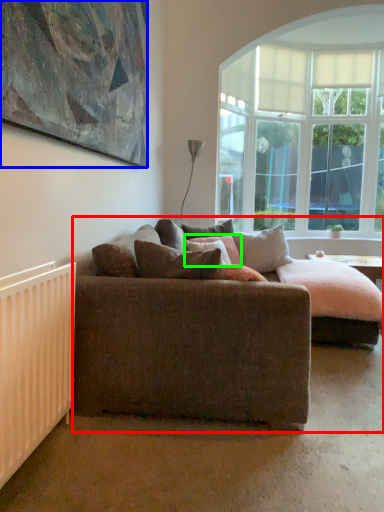
Question: Which object is positioned farthest from studio couch (highlighted by a red box)? Select from picture frame (highlighted by a blue box) and pillow (highlighted by a green box).

Choices:
 (A) picture frame
 (B) pillow

Answer: (B)